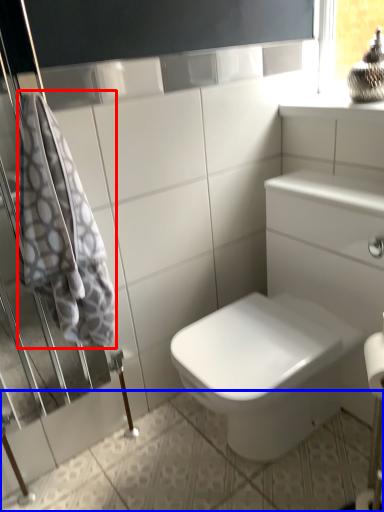
Question: Which point is further to the camera, bath towel (highlighted by a red box) or ceramic tile (highlighted by a blue box)?

Choices:
 (A) bath towel
 (B) ceramic tile

Answer: (A)